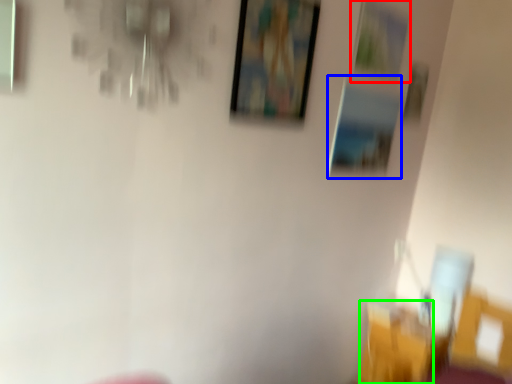
Question: Considering the real-world distances, which object is farthest from picture frame (highlighted by a red box)? picture frame (highlighted by a blue box) or chair (highlighted by a green box)?

Choices:
 (A) picture frame
 (B) chair

Answer: (B)